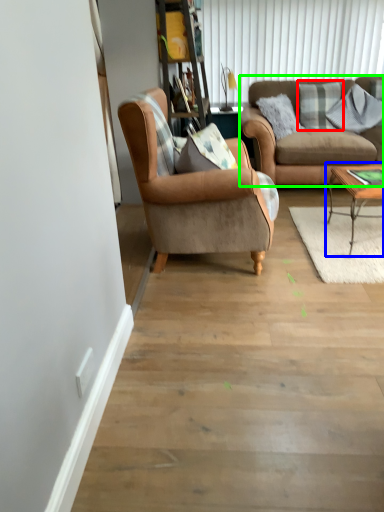
Question: Which is farther away from pillow (highlighted by a red box)? coffee table (highlighted by a blue box) or studio couch (highlighted by a green box)?

Choices:
 (A) coffee table
 (B) studio couch

Answer: (A)